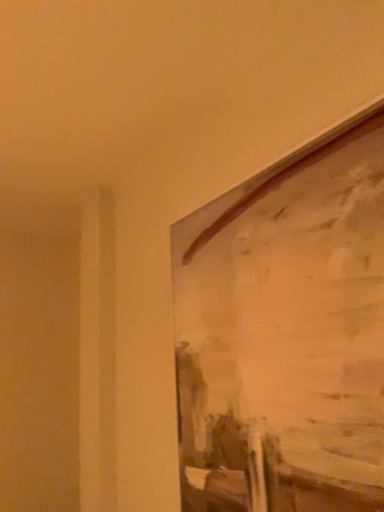
This screenshot has height=512, width=384. What do you see at coordinates (286, 333) in the screenshot?
I see `wooden frame at upper right` at bounding box center [286, 333].

At what (x,y) coordinates should I click in order to perform the action: click on wooden frame at upper right. Please return your answer as a coordinate pair (x, y). The width and height of the screenshot is (384, 512). Looking at the image, I should click on (286, 333).

Measure the distance between wooden frame at upper right and camera.

The distance of wooden frame at upper right from camera is 24.79 inches.

You are a GUI agent. You are given a task and a screenshot of the screen. Output one action in this format:
    pyautogui.click(x=<x>, y=<y>)
    Task: Click on the wooden frame at upper right
    Image resolution: width=384 pixels, height=512 pixels.
    Given the screenshot: What is the action you would take?
    pyautogui.click(x=286, y=333)